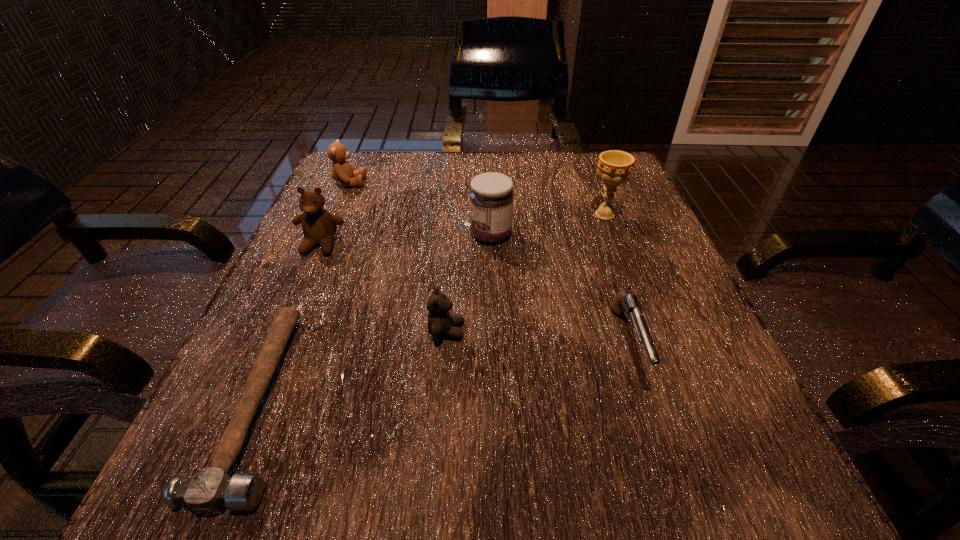
You are a GUI agent. You are given a task and a screenshot of the screen. Output one action in this format:
    pyautogui.click(x=<x>, y=<y>)
    Task: Click on the chalice at the right edge
    Image resolution: width=960 pixels, height=540 pixels.
    Given the screenshot: What is the action you would take?
    pyautogui.click(x=614, y=167)

This screenshot has width=960, height=540. I want to click on gun that is at the right edge, so click(628, 303).

Where is `object that is at the far left corner`? This screenshot has width=960, height=540. object that is at the far left corner is located at coordinates (344, 173).

This screenshot has height=540, width=960. I want to click on object at the near left corner, so click(209, 491).

Where is `vacant space at the far edge of the desktop`? The image size is (960, 540). vacant space at the far edge of the desktop is located at coordinates (422, 197).

Where is `vacant point at the near edge`? The height and width of the screenshot is (540, 960). vacant point at the near edge is located at coordinates (477, 465).

In the image, there is a desktop. What are the coordinates of `vacant space at the left edge` in the screenshot? It's located at (307, 403).

In the image, there is a desktop. Where is `vacant space at the right edge`? This screenshot has height=540, width=960. vacant space at the right edge is located at coordinates (606, 222).

Locate an element on the screen. This screenshot has width=960, height=540. vacant space at the far left corner of the desktop is located at coordinates (330, 178).

Where is `vacant space at the far right corner`? Image resolution: width=960 pixels, height=540 pixels. vacant space at the far right corner is located at coordinates (574, 153).